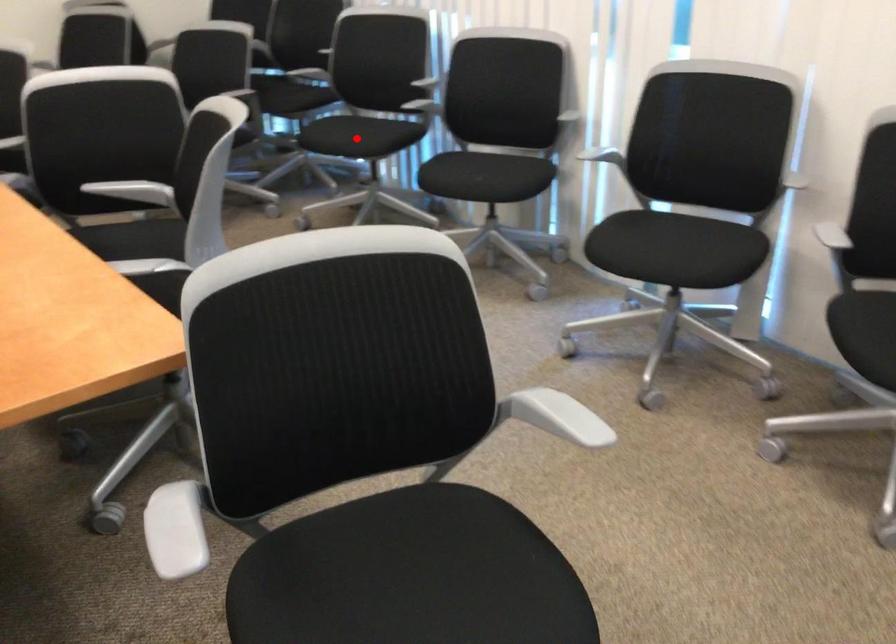
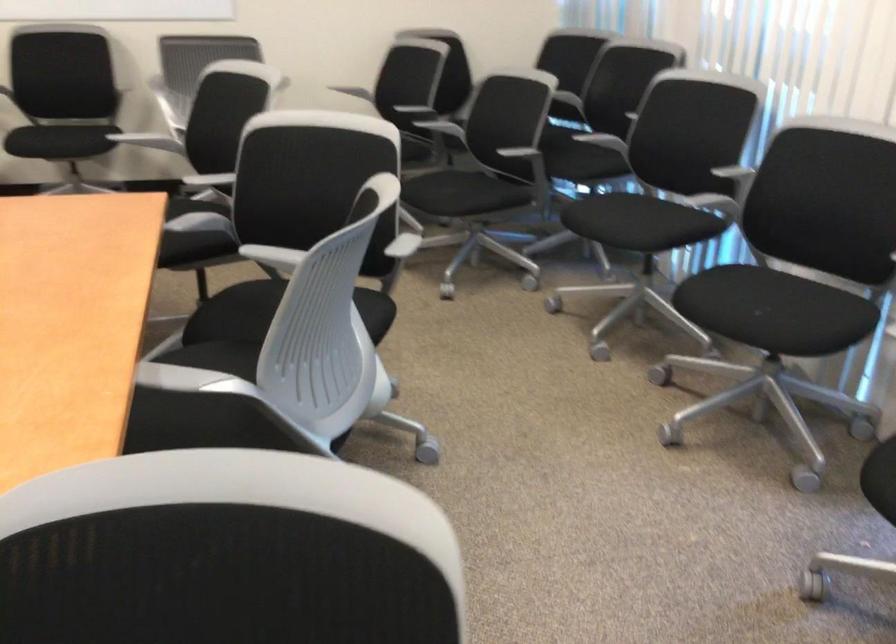
In the second image, find the point that corresponds to the highlighted location in the first image.

(624, 221)